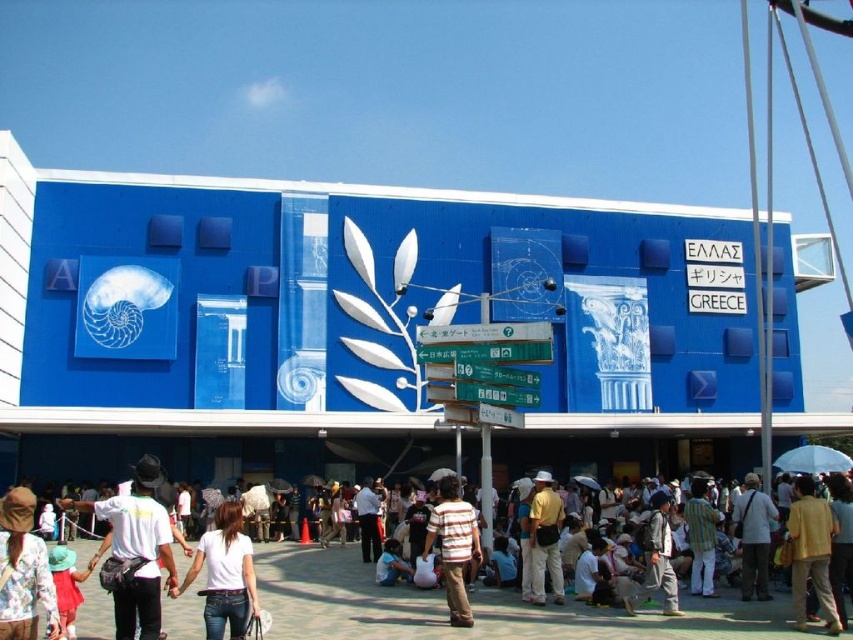
How distant is white cotton shirt at lower center from white matte shirt at center?

white cotton shirt at lower center and white matte shirt at center are 10.17 meters apart.

Is white cotton shirt at lower center behind white matte shirt at center?

Yes.

Is point (392, 595) in front of point (67, 502)?

Yes.

Find the location of a particular element. The height and width of the screenshot is (640, 853). white cotton shirt at lower center is located at coordinates (473, 608).

Is white matte shirt at center below floral print shirt at lower left?

Correct, white matte shirt at center is located below floral print shirt at lower left.

Does white matte shirt at center have a lesser height compared to floral print shirt at lower left?

In fact, white matte shirt at center may be taller than floral print shirt at lower left.

In order to click on white matte shirt at center in this screenshot , I will do `click(137, 548)`.

Which is in front, point (799, 560) or point (456, 548)?

Positioned in front is point (799, 560).

What do you see at coordinates (811, 552) in the screenshot?
I see `yellow matte shirt at lower right` at bounding box center [811, 552].

I want to click on yellow matte shirt at lower right, so click(811, 552).

Where is `yellow matte shirt at lower right`? This screenshot has width=853, height=640. yellow matte shirt at lower right is located at coordinates (811, 552).